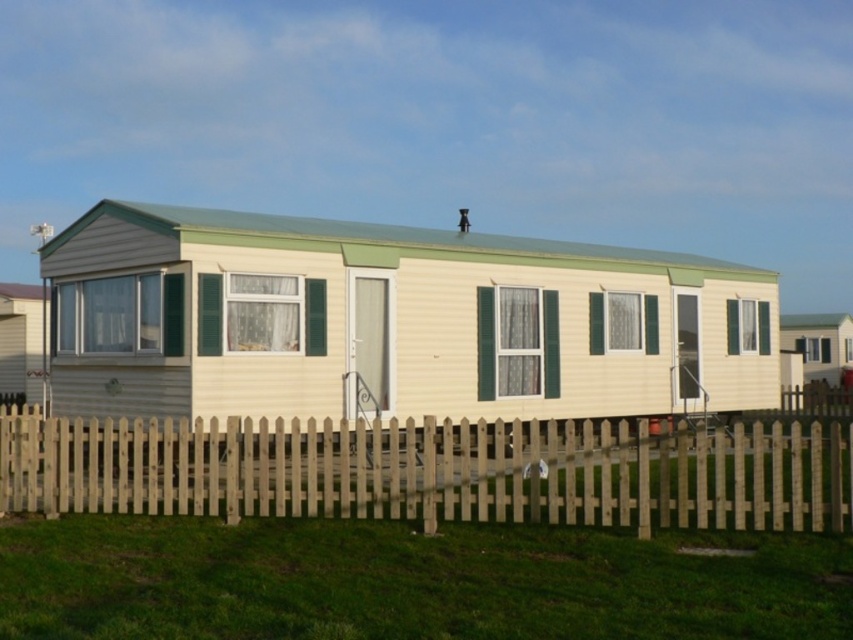
Can you confirm if matte yellow trailer at center is taller than wooden picket fence at lower center?

Yes, matte yellow trailer at center is taller than wooden picket fence at lower center.

Which is behind, point (238, 250) or point (122, 442)?

The point (238, 250) is behind.

Where is `matte yellow trailer at center`? matte yellow trailer at center is located at coordinates (392, 321).

Find the location of a particular element. green grass at lower center is located at coordinates (410, 580).

Can you confirm if green grass at lower center is thinner than wooden picket fence at lower center?

Yes, green grass at lower center is thinner than wooden picket fence at lower center.

Between point (173, 570) and point (252, 497), which one is positioned in front?

Point (173, 570) is more forward.

Locate an element on the screen. green grass at lower center is located at coordinates (410, 580).

Does matte yellow trailer at center come behind green grass at lower center?

Yes.

Which is behind, point (624, 376) or point (341, 563)?

Point (624, 376)

Locate an element on the screen. This screenshot has width=853, height=640. matte yellow trailer at center is located at coordinates (392, 321).